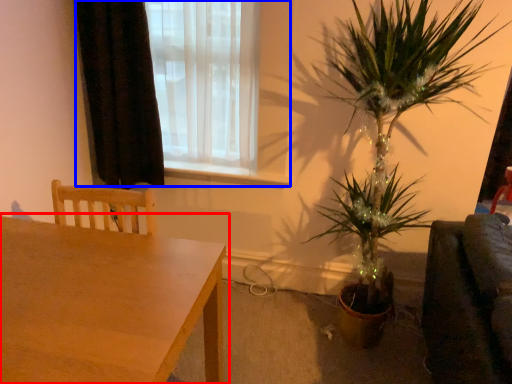
Question: Which of the following is the farthest to the observer, table (highlighted by a red box) or window (highlighted by a blue box)?

Choices:
 (A) table
 (B) window

Answer: (B)